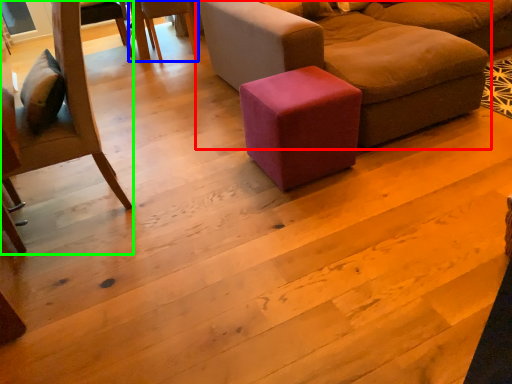
Question: Based on their relative distances, which object is farther from studio couch (highlighted by a red box)? Choose from chair (highlighted by a blue box) and chair (highlighted by a green box).

Choices:
 (A) chair
 (B) chair

Answer: (A)